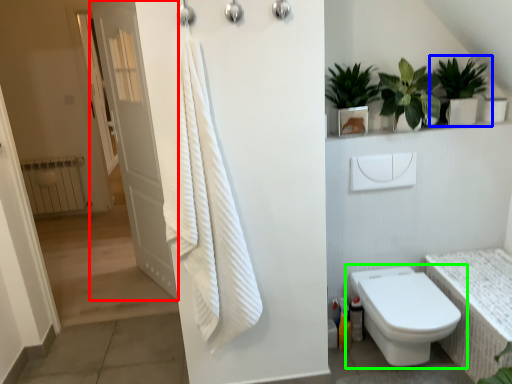
Question: Which is farther away from door (highlighted by a red box)? houseplant (highlighted by a blue box) or toilet (highlighted by a green box)?

Choices:
 (A) houseplant
 (B) toilet

Answer: (A)